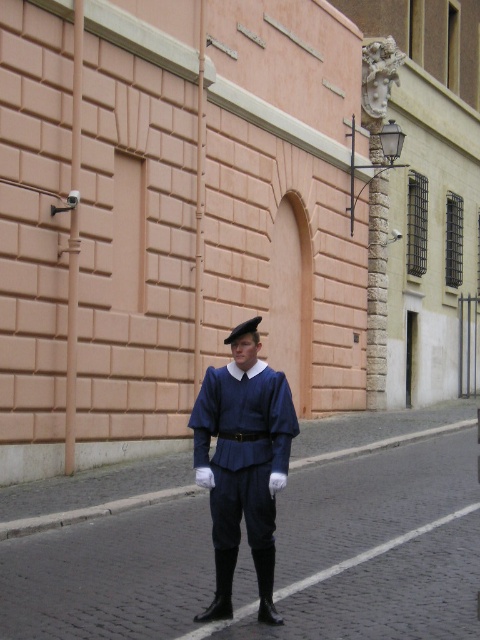
Does matte blue uniform at center appear under black felt hat at center?

Indeed, matte blue uniform at center is positioned under black felt hat at center.

This screenshot has width=480, height=640. In order to click on matte blue uniform at center in this screenshot , I will do `click(242, 467)`.

Locate an element on the screen. This screenshot has height=640, width=480. matte blue uniform at center is located at coordinates (242, 467).